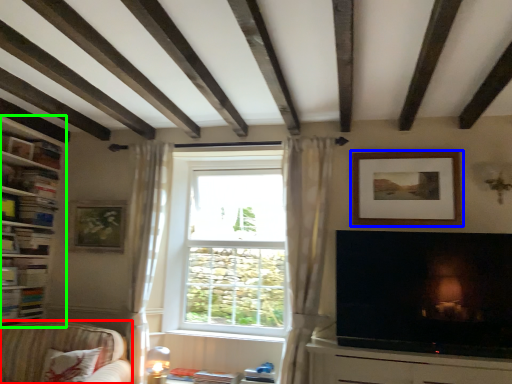
Question: Considering the real-world distances, which object is closest to studio couch (highlighted by a red box)? picture frame (highlighted by a blue box) or shelf (highlighted by a green box).

Choices:
 (A) picture frame
 (B) shelf

Answer: (B)